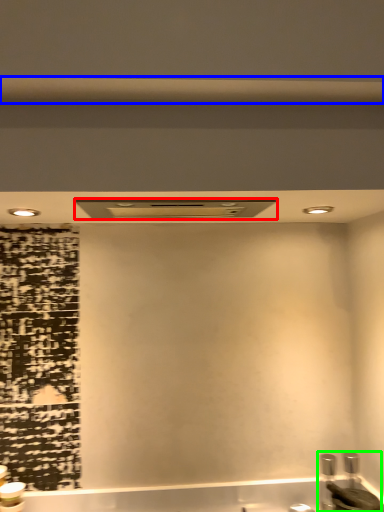
Question: Considering the real-world distances, which object is farthest from exhaust hood (highlighted by a red box)? beam (highlighted by a blue box) or sink (highlighted by a green box)?

Choices:
 (A) beam
 (B) sink

Answer: (B)